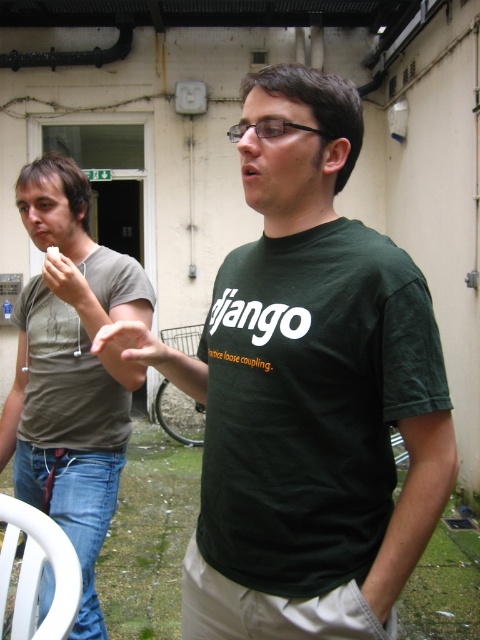
You are standing at the point marked as point (311, 392) in the image. Which object from the scene are you currently standing on?

The point (311, 392) is on the dark green T shirt at center.